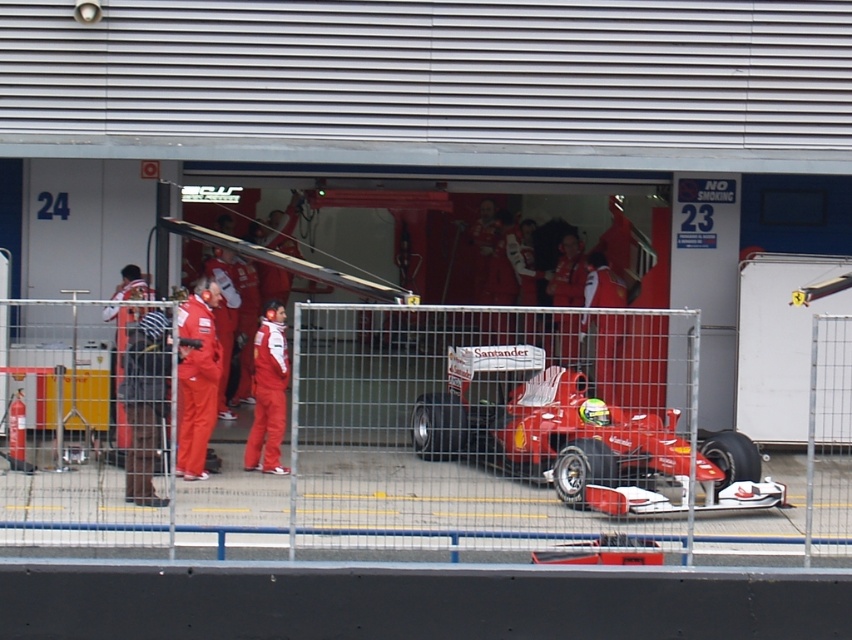
Question: Can you confirm if shiny red race car at center is bigger than red fabric suit at center?

Choices:
 (A) yes
 (B) no

Answer: (A)

Question: Does metal at center appear on the right side of shiny red race car at center?

Choices:
 (A) yes
 (B) no

Answer: (B)

Question: Does metal at center have a smaller size compared to shiny red race car at center?

Choices:
 (A) no
 (B) yes

Answer: (A)

Question: Among these objects, which one is nearest to the camera?

Choices:
 (A) shiny red race car at center
 (B) metal at center

Answer: (B)

Question: Which point appears farthest from the camera in this image?

Choices:
 (A) (191, 381)
 (B) (119, 451)
 (C) (672, 417)

Answer: (B)

Question: Estimate the real-world distances between objects in this image. Which object is farther from the red fabric suit at center?

Choices:
 (A) shiny red race car at center
 (B) metal at center

Answer: (B)